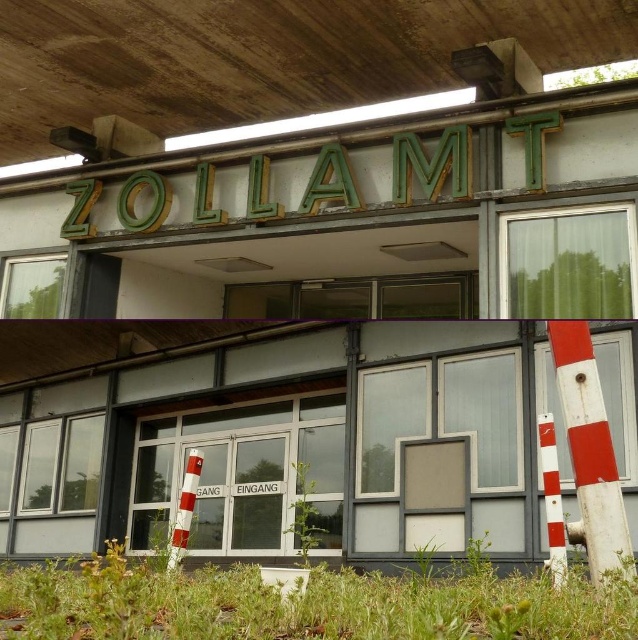
Consider the image. Between white striped cone at lower right and white striped cone at center, which one is positioned lower?

white striped cone at center

Who is taller, white striped cone at lower right or white striped cone at center?

Standing taller between the two is white striped cone at lower right.

What do you see at coordinates (551, 499) in the screenshot? I see `white striped cone at lower right` at bounding box center [551, 499].

You are a GUI agent. You are given a task and a screenshot of the screen. Output one action in this format:
    pyautogui.click(x=<x>, y=<y>)
    Task: Click on the white striped cone at lower right
    This screenshot has height=640, width=638.
    Given the screenshot: What is the action you would take?
    pyautogui.click(x=551, y=499)

Can you confirm if transparent glass door at center is positioned to the left of white striped cone at lower right?

Correct, you'll find transparent glass door at center to the left of white striped cone at lower right.

Who is taller, transparent glass door at center or white striped cone at lower right?

With more height is transparent glass door at center.

What do you see at coordinates (322, 440) in the screenshot?
I see `transparent glass door at center` at bounding box center [322, 440].

Identify the location of transparent glass door at center. (322, 440).

Is point (512, 484) farther from camera compared to point (193, 467)?

Yes, point (512, 484) is farther from viewer.

Which of these two, transparent glass door at center or white striped cone at center, stands shorter?

Standing shorter between the two is white striped cone at center.

Which is in front, point (457, 451) or point (182, 545)?

Point (182, 545) is more forward.

Identify the location of transparent glass door at center. This screenshot has width=638, height=640. (322, 440).